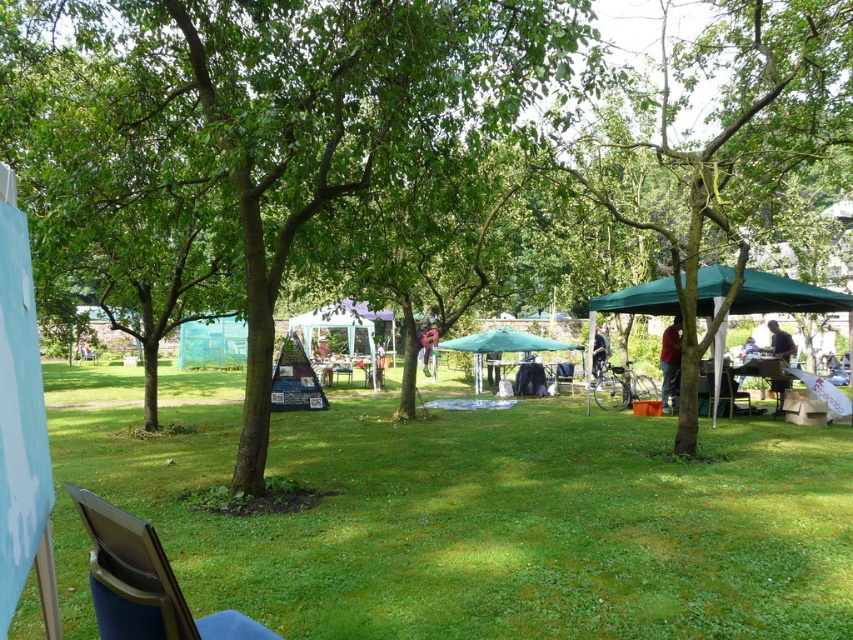
Can you confirm if wooden chair at center is shorter than matte black backpack at center?

Incorrect, wooden chair at center's height does not fall short of matte black backpack at center's.

Between wooden chair at center and matte black backpack at center, which one has more height?

wooden chair at center

Image resolution: width=853 pixels, height=640 pixels. What do you see at coordinates (732, 394) in the screenshot? I see `wooden chair at center` at bounding box center [732, 394].

The width and height of the screenshot is (853, 640). What are the coordinates of `wooden chair at center` in the screenshot? It's located at (732, 394).

Consider the image. Is blue fabric folding chair at lower left thinner than dark brown leather jacket at center?

Correct, blue fabric folding chair at lower left's width is less than dark brown leather jacket at center's.

Can you confirm if blue fabric folding chair at lower left is bigger than dark brown leather jacket at center?

No, blue fabric folding chair at lower left is not bigger than dark brown leather jacket at center.

Find the location of a particular element. blue fabric folding chair at lower left is located at coordinates (143, 582).

The height and width of the screenshot is (640, 853). In order to click on blue fabric folding chair at lower left in this screenshot , I will do `click(143, 582)`.

Who is more forward, (445,634) or (320,342)?

Point (445,634) is in front.

Is green grass at center bigger than matte black backpack at center?

Yes.

Who is more distant from viewer, (676, 634) or (318, 349)?

The point (318, 349) is behind.

Where is `green grass at center`? green grass at center is located at coordinates 469,515.